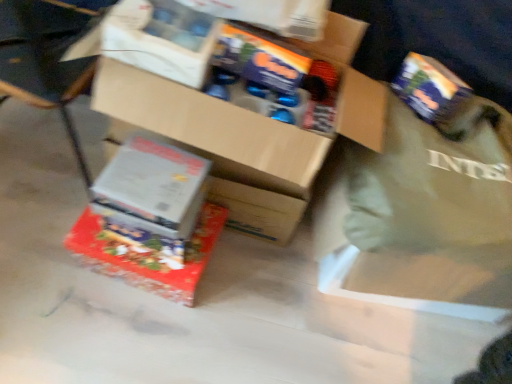
Question: Is cardboard box at center, marked as the 3th box in a bottom-to-top arrangement, taller or shorter than wooden chair at lower left?

Choices:
 (A) short
 (B) tall

Answer: (A)

Question: From a real-world perspective, is cardboard box at center, marked as the 3th box in a bottom-to-top arrangement, physically located above or below wooden chair at lower left?

Choices:
 (A) below
 (B) above

Answer: (B)

Question: Considering the real-world distances, which object is farthest from the green fabric tote bag at right?

Choices:
 (A) wooden chair at lower left
 (B) cardboard box at center, the first box positioned from the top
 (C) white cardboard box at lower left, marked as the 2th box in a top-to-bottom arrangement
 (D) shiny metallic box at center, positioned as the first box in bottom-to-top order

Answer: (A)

Question: Based on their relative distances, which object is farther from the green fabric tote bag at right?

Choices:
 (A) white cardboard box at lower left, marked as the 2th box in a top-to-bottom arrangement
 (B) wooden chair at lower left
 (C) shiny metallic box at center, positioned as the first box in bottom-to-top order
 (D) cardboard box at center, the first box positioned from the top

Answer: (B)